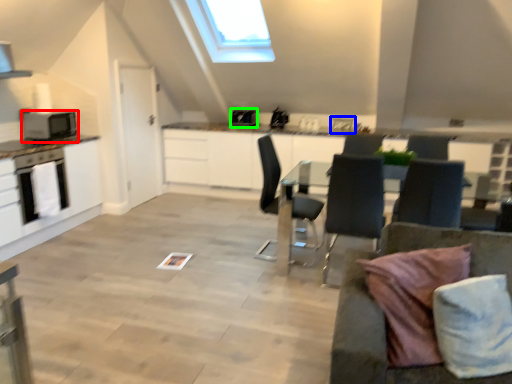
Question: Which object is the farthest from appliance (highlighted by a red box)? Choose among these: sink (highlighted by a blue box) or appliance (highlighted by a green box).

Choices:
 (A) sink
 (B) appliance

Answer: (A)